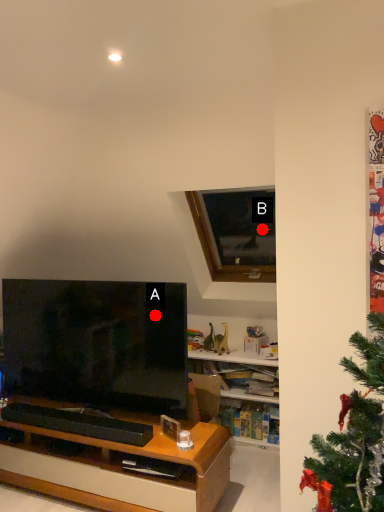
Question: Two points are circled on the image, labeled by A and B beside each circle. Which point is further to the camera?

Choices:
 (A) A is further
 (B) B is further

Answer: (B)